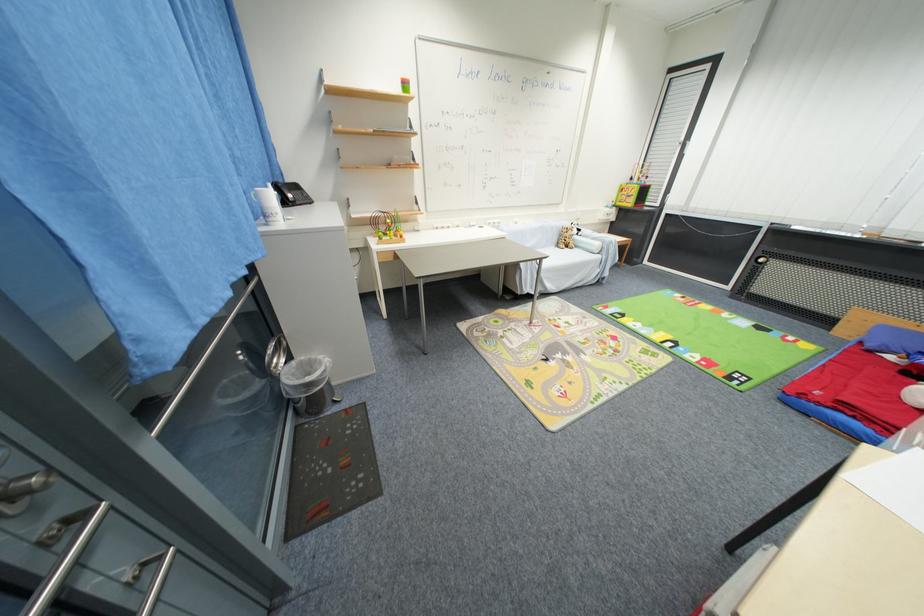
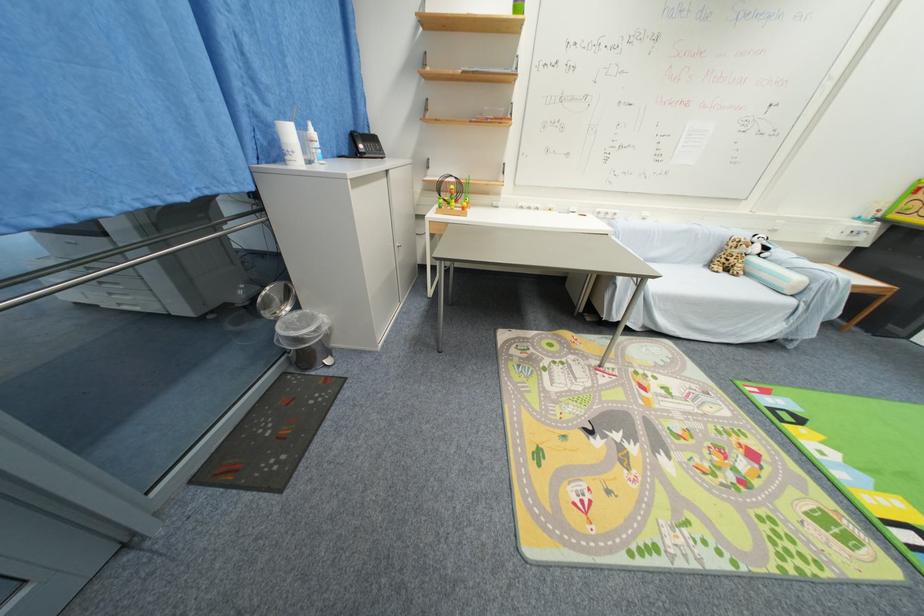
Locate, in the second image, the point that corresponds to (563,246) in the first image.

(714, 265)